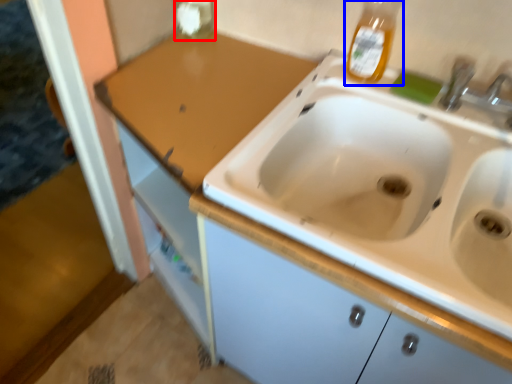
Question: Which of the following is the farthest to the observer, bottle (highlighted by a red box) or bottle (highlighted by a blue box)?

Choices:
 (A) bottle
 (B) bottle

Answer: (A)